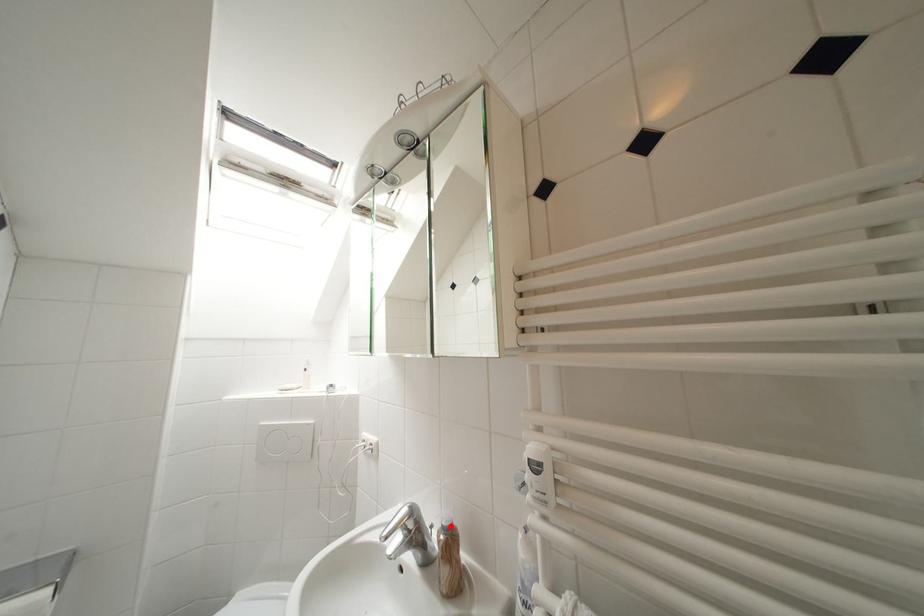
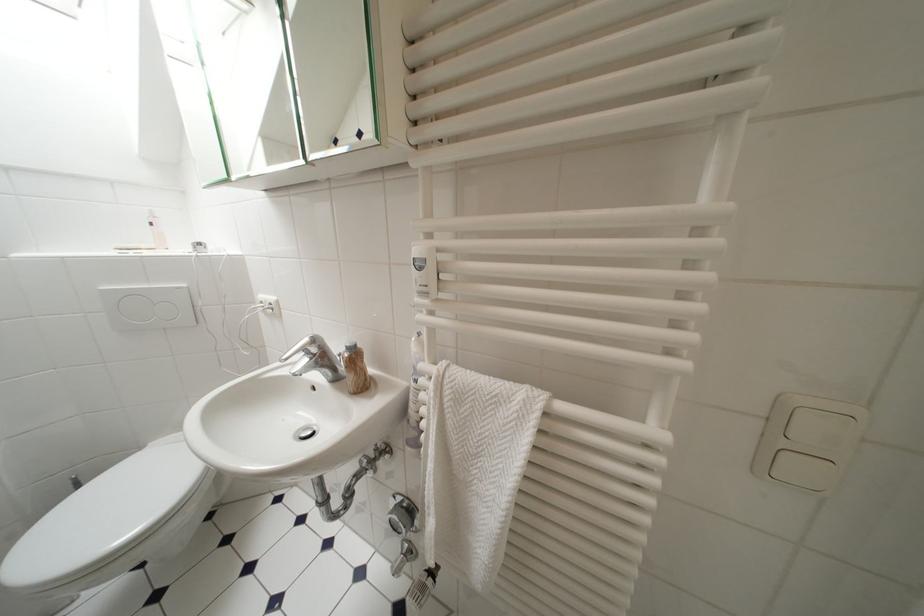
Find the pixel in the second image that matches the highlighted location in the first image.

(355, 347)